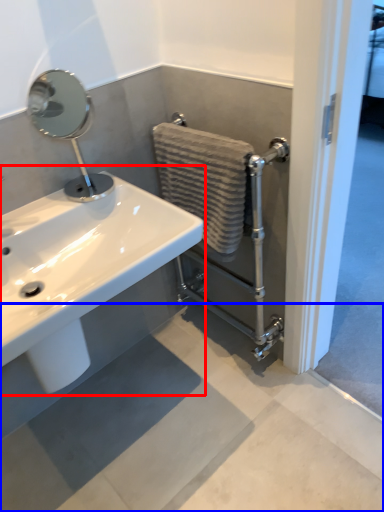
Question: Among these objects, which one is nearest to the camera, sink (highlighted by a red box) or concrete (highlighted by a blue box)?

Choices:
 (A) sink
 (B) concrete

Answer: (A)